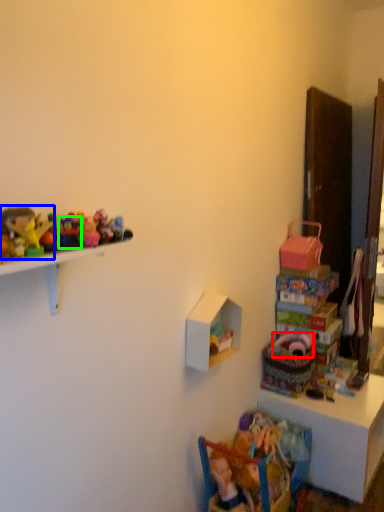
Question: Considering the real-world distances, which object is closest to toy (highlighted by a red box)? toy (highlighted by a blue box) or toy (highlighted by a green box).

Choices:
 (A) toy
 (B) toy

Answer: (B)